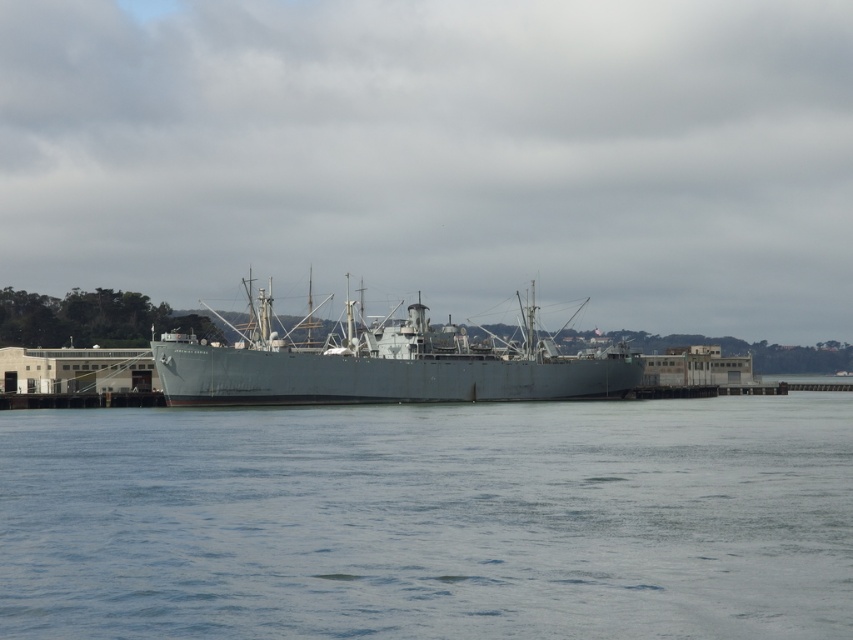
Question: Is clear water at center below gray matte ship at center?

Choices:
 (A) no
 (B) yes

Answer: (B)

Question: Is clear water at center closer to camera compared to gray matte ship at center?

Choices:
 (A) yes
 (B) no

Answer: (A)

Question: Is clear water at center positioned before gray matte ship at center?

Choices:
 (A) yes
 (B) no

Answer: (A)

Question: Which object is closer to the camera taking this photo?

Choices:
 (A) gray matte ship at center
 (B) clear water at center

Answer: (B)

Question: Which point is closer to the camera?

Choices:
 (A) (641, 632)
 (B) (320, 380)

Answer: (A)

Question: Which point is closer to the camera taking this photo?

Choices:
 (A) (144, 497)
 (B) (457, 388)

Answer: (A)